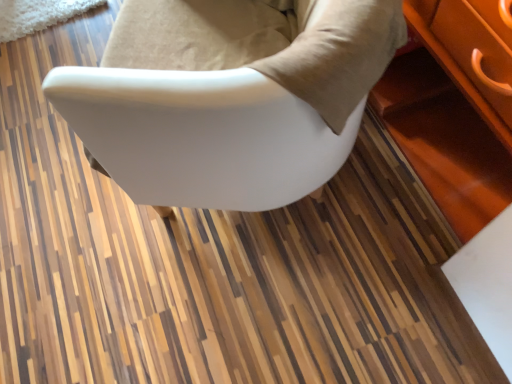
Question: Visually, is white matte chair at center positioned to the left or to the right of white glossy table at lower right?

Choices:
 (A) left
 (B) right

Answer: (A)

Question: Is point (222, 21) positioned closer to the camera than point (490, 269)?

Choices:
 (A) closer
 (B) farther

Answer: (B)

Question: From the image's perspective, is white matte chair at center located above or below white glossy table at lower right?

Choices:
 (A) above
 (B) below

Answer: (A)

Question: Considering the positions of white glossy table at lower right and white matte chair at center in the image, is white glossy table at lower right wider or thinner than white matte chair at center?

Choices:
 (A) wide
 (B) thin

Answer: (B)

Question: Considering the positions of point (484, 268) and point (304, 124), is point (484, 268) closer or farther from the camera than point (304, 124)?

Choices:
 (A) closer
 (B) farther

Answer: (B)

Question: Based on their positions, is white glossy table at lower right located to the left or right of white matte chair at center?

Choices:
 (A) right
 (B) left

Answer: (A)

Question: From a real-world perspective, is white glossy table at lower right above or below white matte chair at center?

Choices:
 (A) below
 (B) above

Answer: (A)